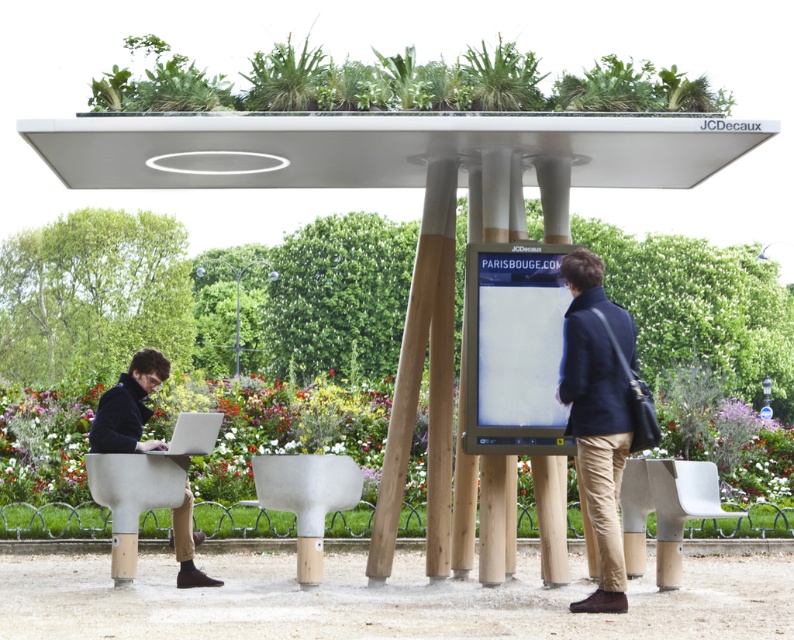
Question: Among these points, which one is farthest from the camera?

Choices:
 (A) (656, 508)
 (B) (141, 445)

Answer: (A)

Question: Which point is closer to the camera taking this photo?

Choices:
 (A) (160, 483)
 (B) (353, 401)
 (C) (685, 483)
 (D) (607, 342)

Answer: (D)

Question: Considering the relative positions of matte black jacket at lower left and white wood table at center in the image provided, where is matte black jacket at lower left located with respect to white wood table at center?

Choices:
 (A) left
 (B) right

Answer: (A)

Question: Does matte black jacket at lower left appear over white wood table at center?

Choices:
 (A) no
 (B) yes

Answer: (B)

Question: Is matte black jacket at lower left bigger than white wood table at center?

Choices:
 (A) yes
 (B) no

Answer: (A)

Question: Among these objects, which one is farthest from the camera?

Choices:
 (A) green leafy plant at center
 (B) matte gray chair at lower left

Answer: (A)